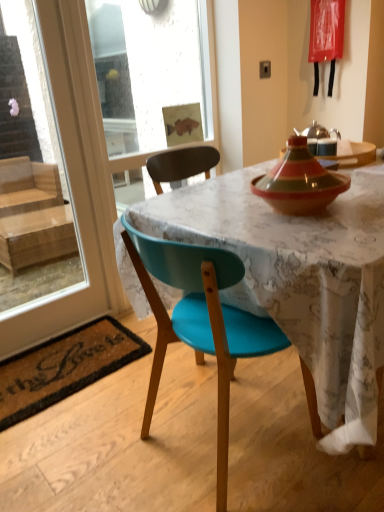
Locate an element on the screen. The height and width of the screenshot is (512, 384). matte ceramic tagine at upper right is located at coordinates (352, 154).

Measure the distance between point (360,165) and camera.

A distance of 1.71 meters exists between point (360,165) and camera.

This screenshot has height=512, width=384. What do you see at coordinates (31, 170) in the screenshot?
I see `transparent glass door at left` at bounding box center [31, 170].

What do you see at coordinates (150, 70) in the screenshot?
I see `transparent glass screen door at upper left` at bounding box center [150, 70].

Describe the element at coordinates (64, 367) in the screenshot. I see `coir mat at lower left` at that location.

The height and width of the screenshot is (512, 384). Find the location of `matte ceramic tagine at upper right`. matte ceramic tagine at upper right is located at coordinates (352, 154).

I want to click on place mat behind the transparent glass door at left, so click(x=64, y=367).

Does point (52, 384) appear closer or farther from the camera than point (14, 65)?

Point (52, 384) is positioned closer to the camera compared to point (14, 65).

Between coir mat at lower left and transparent glass door at left, which one is positioned in front?

transparent glass door at left is more forward.

In the scene shown: Does coir mat at lower left have a smaller size compared to transparent glass door at left?

Correct, coir mat at lower left occupies less space than transparent glass door at left.

Is coir mat at lower left positioned with its back to transparent glass screen door at upper left?

That's right, coir mat at lower left is facing away from transparent glass screen door at upper left.

Would you consider coir mat at lower left to be distant from transparent glass screen door at upper left?

Yes, coir mat at lower left and transparent glass screen door at upper left are quite far apart.

Which object is positioned more to the left, coir mat at lower left or transparent glass screen door at upper left?

coir mat at lower left is more to the left.

Is coir mat at lower left inside or outside of transparent glass screen door at upper left?

coir mat at lower left exists outside the volume of transparent glass screen door at upper left.

Does teal plastic chair at center have a greater height compared to transparent glass screen door at upper left?

No, teal plastic chair at center is not taller than transparent glass screen door at upper left.

Are teal plastic chair at center and transparent glass screen door at upper left located far from each other?

Yes, teal plastic chair at center and transparent glass screen door at upper left are quite far apart.

Is teal plastic chair at center wider than transparent glass screen door at upper left?

Yes, teal plastic chair at center is wider than transparent glass screen door at upper left.

Is teal plastic chair at center surrounding transparent glass screen door at upper left?

No.

Who is smaller, transparent glass screen door at upper left or transparent glass door at left?

Smaller between the two is transparent glass door at left.

In the scene shown: Between transparent glass screen door at upper left and transparent glass door at left, which one has more height?

transparent glass screen door at upper left is taller.

In the scene shown: Is transparent glass screen door at upper left not within transparent glass door at left?

No, transparent glass screen door at upper left is inside transparent glass door at left's boundary.

From a real-world perspective, is teal plastic chair at center above or below transparent glass door at left?

In terms of real-world spatial position, teal plastic chair at center is below transparent glass door at left.

Identify the location of window screen that appears behind the teal plastic chair at center. (31, 170).

Is teal plastic chair at center far away from transparent glass door at left?

Yes, teal plastic chair at center and transparent glass door at left are located far from each other.

Measure the distance between matte ceramic tagine at upper right and transparent glass door at left.

They are 2.22 meters apart.

Is matte ceramic tagine at upper right oriented away from transparent glass door at left?

No, matte ceramic tagine at upper right's orientation is not away from transparent glass door at left.

Is the depth of matte ceramic tagine at upper right greater than that of transparent glass door at left?

Yes, matte ceramic tagine at upper right is further from the viewer.

Which is closer to the camera, (x=348, y=158) or (x=26, y=138)?

The point (x=348, y=158) is more forward.

From a real-world perspective, does transparent glass door at left sit lower than transparent glass screen door at upper left?

Yes.

Locate an element on the screen. This screenshot has width=384, height=512. screen door located above the transparent glass door at left (from a real-world perspective) is located at coordinates (150, 70).

Is transparent glass door at left taller or shorter than transparent glass screen door at upper left?

transparent glass door at left is shorter than transparent glass screen door at upper left.

Is point (11, 178) positioned in front of point (92, 48)?

Yes, point (11, 178) is in front of point (92, 48).

At what (x,y) coordinates should I click in order to perform the action: click on window screen that is above the coir mat at lower left (from a real-world perspective). Please return your answer as a coordinate pair (x, y). Looking at the image, I should click on (31, 170).

Find the location of `place mat beneath the transparent glass screen door at upper left (from a real-world perspective)`. place mat beneath the transparent glass screen door at upper left (from a real-world perspective) is located at coordinates (64, 367).

Which object lies further to the anchor point teal plastic chair at center, transparent glass screen door at upper left or matte ceramic tagine at upper right?

transparent glass screen door at upper left.

From the image, which object appears to be farther from transparent glass door at left, transparent glass screen door at upper left or matte ceramic tagine at upper right?

matte ceramic tagine at upper right is positioned further to the anchor transparent glass door at left.

Looking at this image, which object lies further to the anchor point teal plastic chair at center, coir mat at lower left or matte ceramic tagine at upper right?

The object further to teal plastic chair at center is matte ceramic tagine at upper right.

When comparing their distances from matte ceramic tagine at upper right, does teal plastic chair at center or transparent glass screen door at upper left seem closer?

teal plastic chair at center.

From the image, which object appears to be farther from teal plastic chair at center, transparent glass screen door at upper left or coir mat at lower left?

Among the two, transparent glass screen door at upper left is located further to teal plastic chair at center.

Looking at the image, which one is located closer to matte ceramic tagine at upper right, transparent glass door at left or transparent glass screen door at upper left?

The object closer to matte ceramic tagine at upper right is transparent glass screen door at upper left.

Estimate the real-world distances between objects in this image. Which object is closer to transparent glass screen door at upper left, coir mat at lower left or matte ceramic tagine at upper right?

The object closer to transparent glass screen door at upper left is matte ceramic tagine at upper right.

Which object lies further to the anchor point transparent glass screen door at upper left, transparent glass door at left or coir mat at lower left?

coir mat at lower left.

Find the location of a particular element. This screenshot has width=384, height=512. place mat between transparent glass door at left and teal plastic chair at center in the horizontal direction is located at coordinates (64, 367).

The width and height of the screenshot is (384, 512). Find the location of `chair between transparent glass screen door at upper left and coir mat at lower left vertically`. chair between transparent glass screen door at upper left and coir mat at lower left vertically is located at coordinates (200, 321).

Where is `window screen between transparent glass screen door at upper left and coir mat at lower left in the vertical direction`? window screen between transparent glass screen door at upper left and coir mat at lower left in the vertical direction is located at coordinates (31, 170).

Identify the location of chair between coir mat at lower left and matte ceramic tagine at upper right. (200, 321).